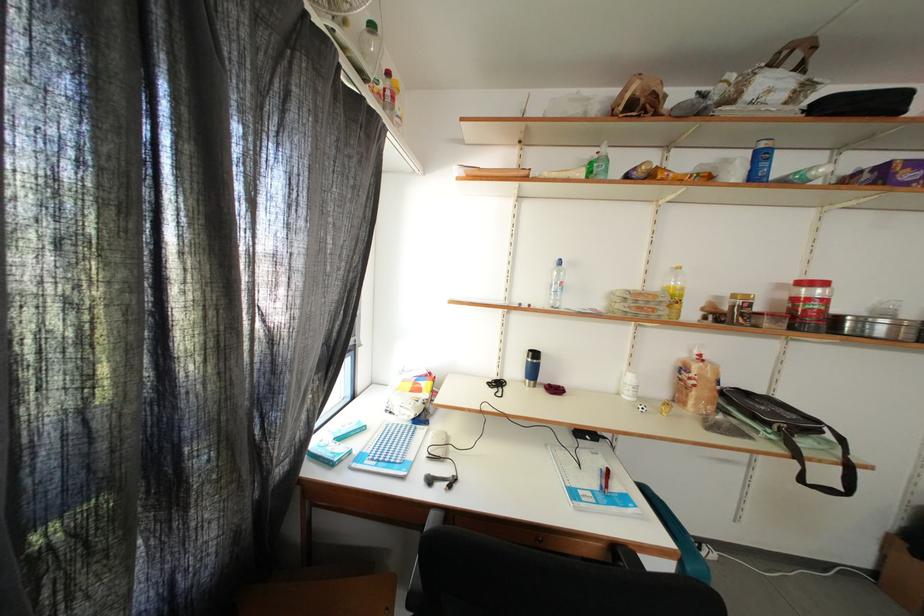
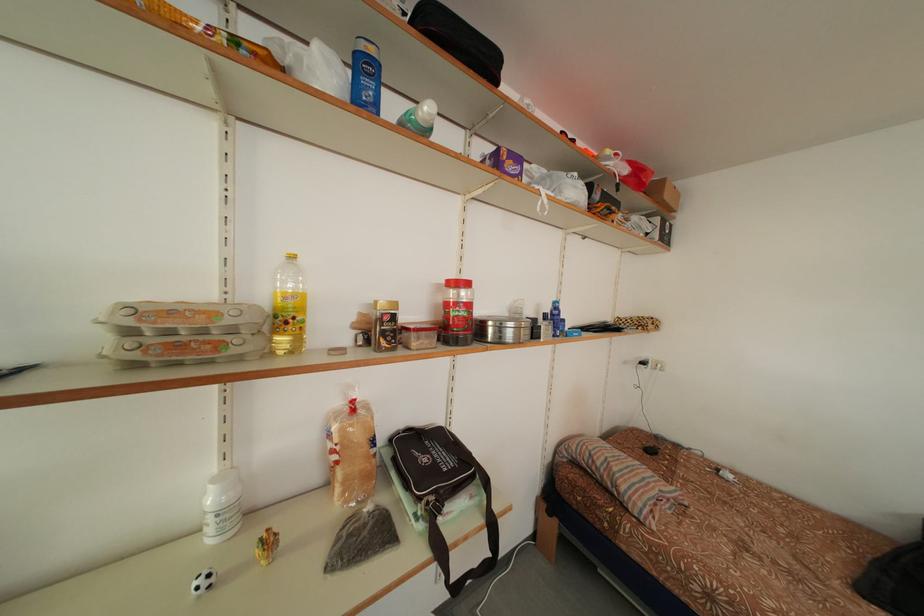
Find the pixel in the second image that matches point (708, 361) in the first image.

(360, 407)